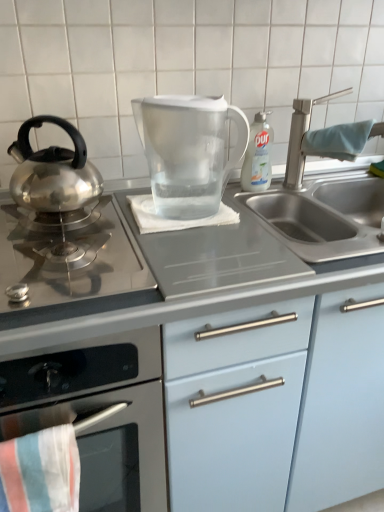
Question: Could satin silver gas stove at left be considered to be inside stainless steel kettle at left, the first kitchen appliance in the bottom-to-top sequence?

Choices:
 (A) no
 (B) yes

Answer: (A)

Question: Can you confirm if stainless steel kettle at left, which ranks as the third kitchen appliance in top-to-bottom order, is positioned to the right of satin silver gas stove at left?

Choices:
 (A) yes
 (B) no

Answer: (B)

Question: Is stainless steel kettle at left, which ranks as the third kitchen appliance in top-to-bottom order, turned away from satin silver gas stove at left?

Choices:
 (A) no
 (B) yes

Answer: (A)

Question: Does stainless steel kettle at left, the first kitchen appliance in the bottom-to-top sequence, have a greater width compared to satin silver gas stove at left?

Choices:
 (A) yes
 (B) no

Answer: (A)

Question: Is stainless steel kettle at left, the first kitchen appliance in the bottom-to-top sequence, outside satin silver gas stove at left?

Choices:
 (A) yes
 (B) no

Answer: (A)

Question: Is blue fabric towel at sink right, the first beach towel when ordered from back to front, inside or outside of transparent plastic pitcher at center, arranged as the 3th kitchen appliance when ordered from the bottom?

Choices:
 (A) inside
 (B) outside

Answer: (B)

Question: Visually, is blue fabric towel at sink right, the first beach towel when ordered from back to front, positioned to the left or to the right of transparent plastic pitcher at center, which is counted as the 1th kitchen appliance, starting from the top?

Choices:
 (A) left
 (B) right

Answer: (B)

Question: Looking at the image, does blue fabric towel at sink right, which ranks as the first beach towel in top-to-bottom order, seem bigger or smaller compared to transparent plastic pitcher at center, which is counted as the 1th kitchen appliance, starting from the top?

Choices:
 (A) small
 (B) big

Answer: (A)

Question: From the image's perspective, is blue fabric towel at sink right, the 3th beach towel in the front-to-back sequence, located above or below transparent plastic pitcher at center, arranged as the 3th kitchen appliance when ordered from the bottom?

Choices:
 (A) above
 (B) below

Answer: (A)

Question: Is light blue matte cabinet at center situated inside stainless steel kettle at left, which ranks as the third kitchen appliance in top-to-bottom order, or outside?

Choices:
 (A) inside
 (B) outside

Answer: (B)

Question: In terms of height, does light blue matte cabinet at center look taller or shorter compared to stainless steel kettle at left, the first kitchen appliance in the bottom-to-top sequence?

Choices:
 (A) short
 (B) tall

Answer: (B)

Question: Is light blue matte cabinet at center to the left or to the right of stainless steel kettle at left, which ranks as the third kitchen appliance in top-to-bottom order, in the image?

Choices:
 (A) left
 (B) right

Answer: (B)

Question: From the image's perspective, is light blue matte cabinet at center positioned above or below stainless steel kettle at left, which ranks as the third kitchen appliance in top-to-bottom order?

Choices:
 (A) above
 (B) below

Answer: (A)

Question: From their relative heights in the image, would you say blue fabric towel at sink right, the first beach towel when ordered from right to left, is taller or shorter than polished stainless steel kettle at left, the second kitchen appliance viewed from the top?

Choices:
 (A) short
 (B) tall

Answer: (A)

Question: From a real-world perspective, is blue fabric towel at sink right, which ranks as the first beach towel in top-to-bottom order, physically located above or below polished stainless steel kettle at left, the second kitchen appliance viewed from the top?

Choices:
 (A) above
 (B) below

Answer: (A)